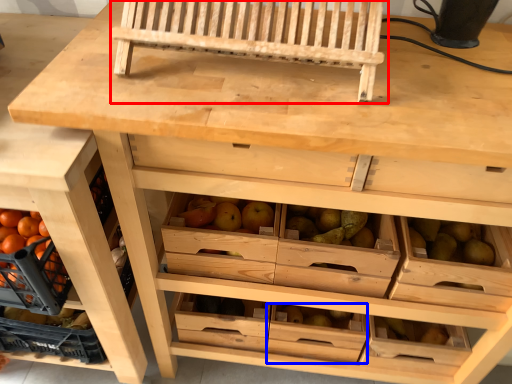
Question: Which object is closer to the camera taking this photo, church bench (highlighted by a red box) or drawer (highlighted by a blue box)?

Choices:
 (A) church bench
 (B) drawer

Answer: (A)